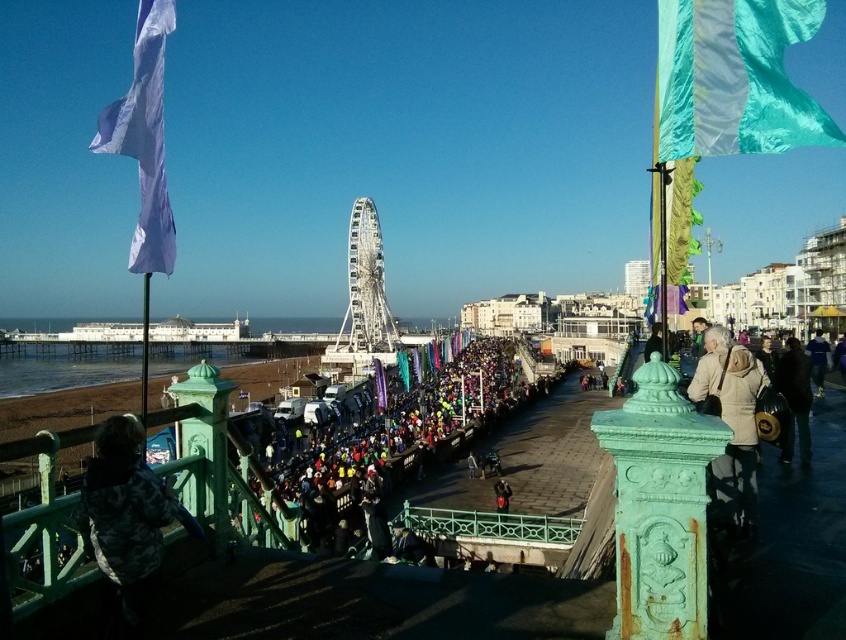
Based on the photo, you are a photographer trying to capture the entire scene of the teal silk flag at upper right and the smooth concrete dock at center in one shot. Based on their sizes, which object should you focus on to ensure both are visible without zooming in?

The teal silk flag at upper right is smaller than the smooth concrete dock at center. To capture both in one shot without zooming in, focus on the larger object, the smooth concrete dock at center, as it requires less detail to be visible.

You are a participant in the event and need to locate your team flag. You see the white fabric flag at upper left and the dark blue leather jacket at lower right. Which object is positioned higher in the scene?

A: The white fabric flag at upper left is located above the dark blue leather jacket at lower right, so it is positioned higher in the scene.

You are standing at the top of the staircase with turquoise railings and want to take a photo of the crowd below. If you focus your camera on the point at coordinates point (718,154) and then shift your focus to point (572,552), will the second point appear closer or farther away in the photo?

The point at coordinates point (718,154) is closer to the camera than point (572,552), so when you shift focus to point (572,552), it will appear farther away in the photo.